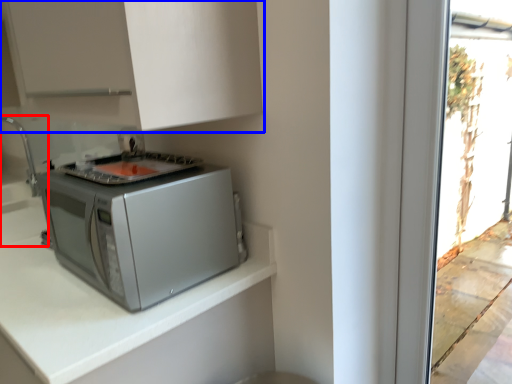
Question: Which of the following is the farthest to the observer, sink (highlighted by a red box) or cabinetry (highlighted by a blue box)?

Choices:
 (A) sink
 (B) cabinetry

Answer: (A)